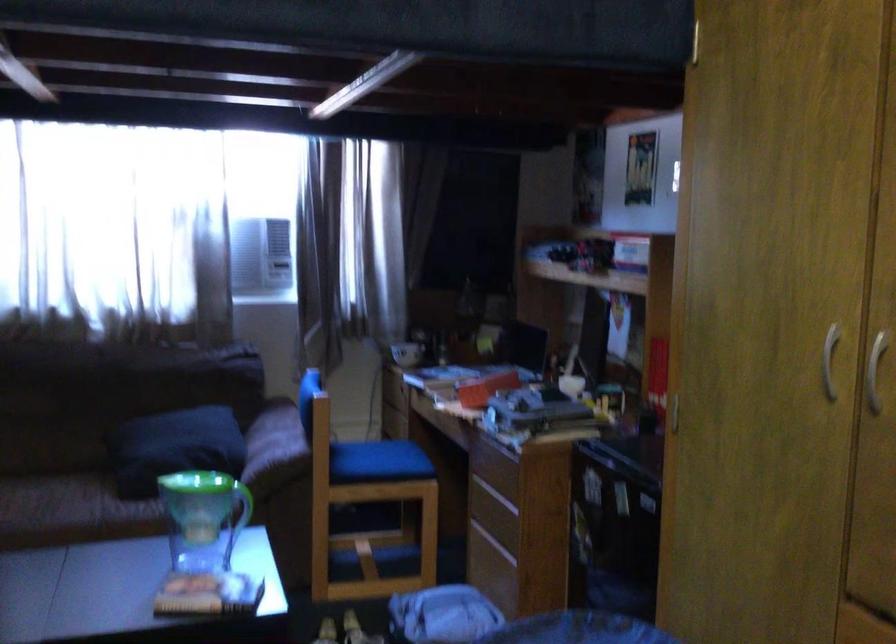
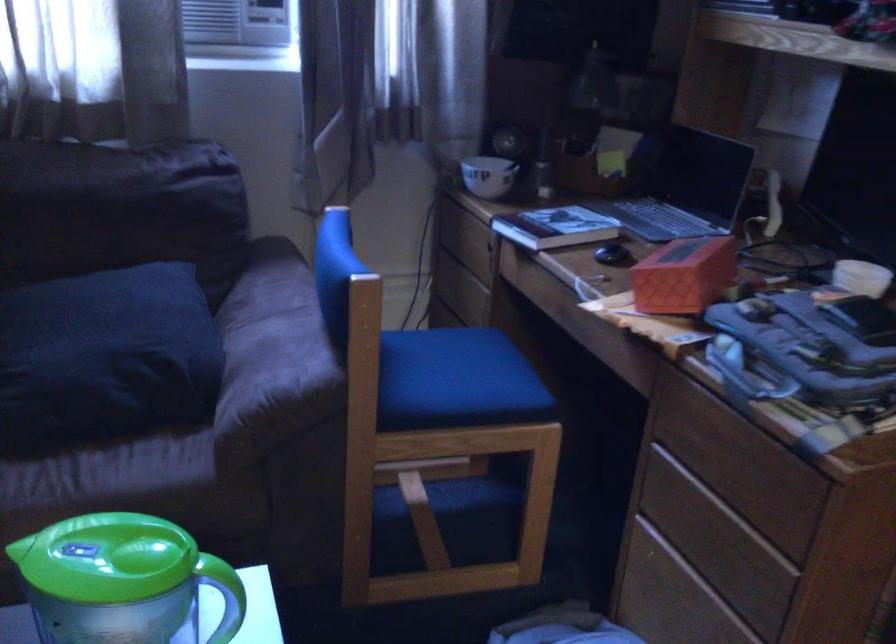
Locate, in the second image, the point that corresponds to (x=377, y=460) in the first image.

(455, 381)